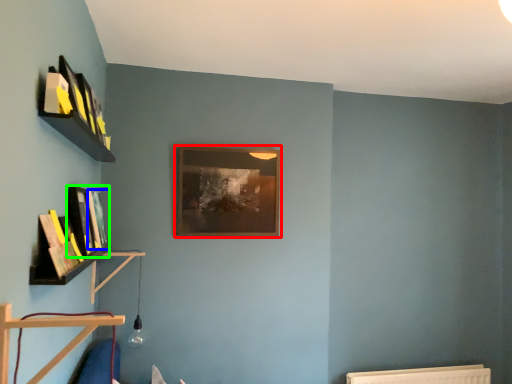
Question: Which object is the farthest from picture frame (highlighted by a red box)? Choose among these: book (highlighted by a blue box) or book (highlighted by a green box).

Choices:
 (A) book
 (B) book

Answer: (B)